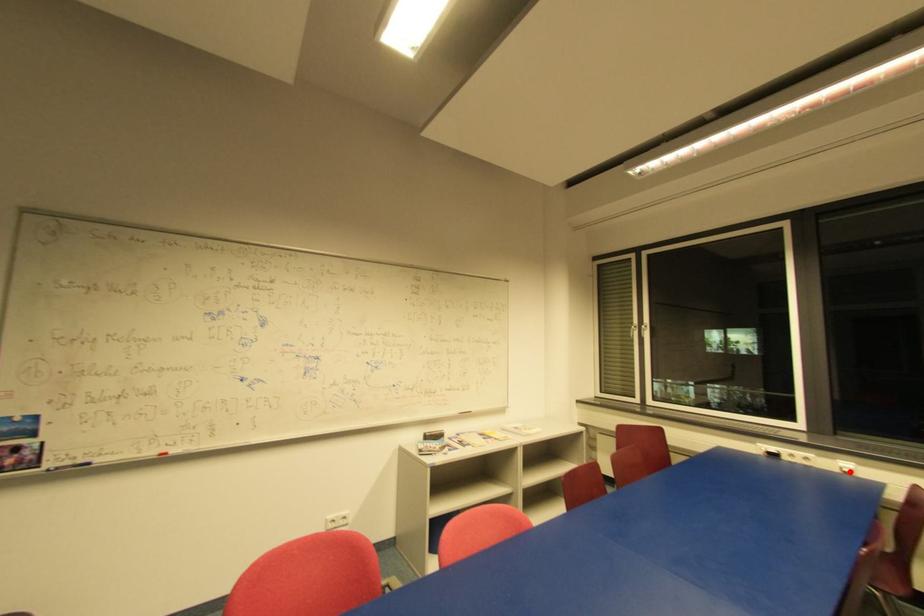
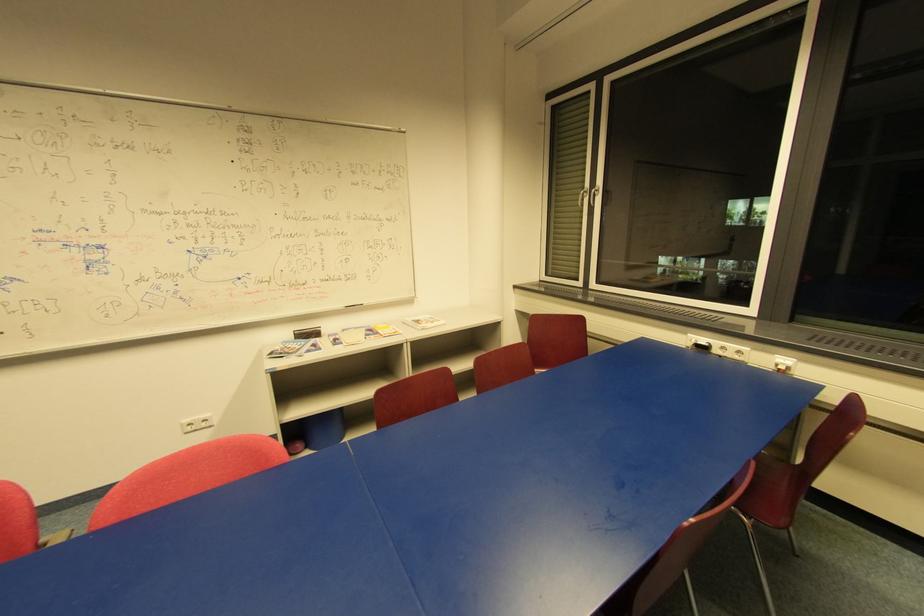
In the second image, find the point that corresponds to the highlighted location in the first image.

(785, 369)